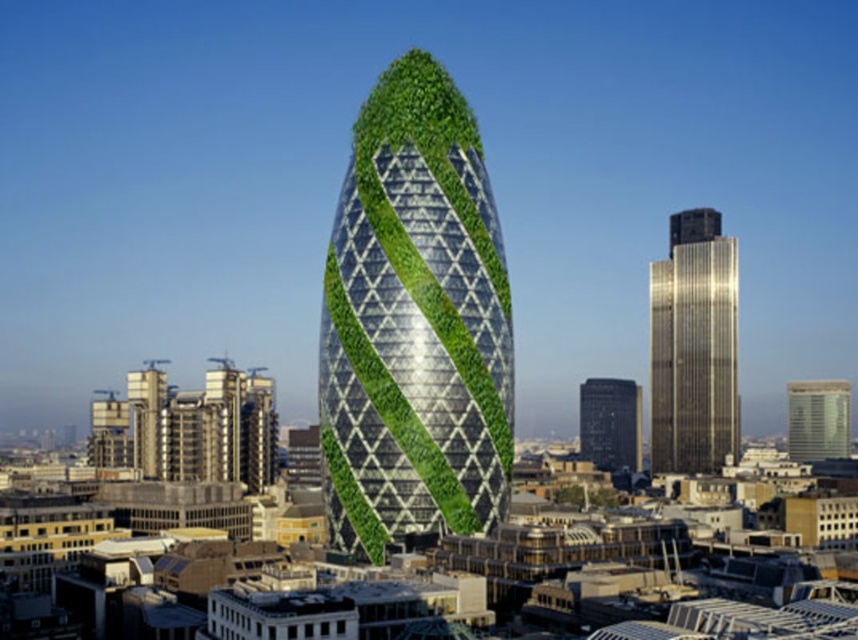
Who is taller, green glass building at center or matte silver tower at right?

green glass building at center

Between point (384, 164) and point (802, 452), which one is positioned behind?

The point (802, 452) is behind.

Is point (482, 397) positioned before point (793, 388)?

Yes, point (482, 397) is in front of point (793, 388).

The height and width of the screenshot is (640, 858). In order to click on green glass building at center in this screenshot , I will do `click(415, 323)`.

Is black glass tower at center below matte silver tower at right?

Yes.

Is black glass tower at center positioned in front of matte silver tower at right?

Yes, black glass tower at center is closer to the viewer.

Is point (608, 381) positioned in front of point (808, 438)?

Yes.

Locate an element on the screen. black glass tower at center is located at coordinates (609, 422).

Which is more to the right, gold reflective glass tower at right or black glass tower at center?

gold reflective glass tower at right

Does gold reflective glass tower at right come behind black glass tower at center?

Yes, it is behind black glass tower at center.

Between point (686, 428) and point (597, 416), which one is positioned in front?

Positioned in front is point (686, 428).

Where is `gold reflective glass tower at right`? This screenshot has height=640, width=858. gold reflective glass tower at right is located at coordinates 693,346.